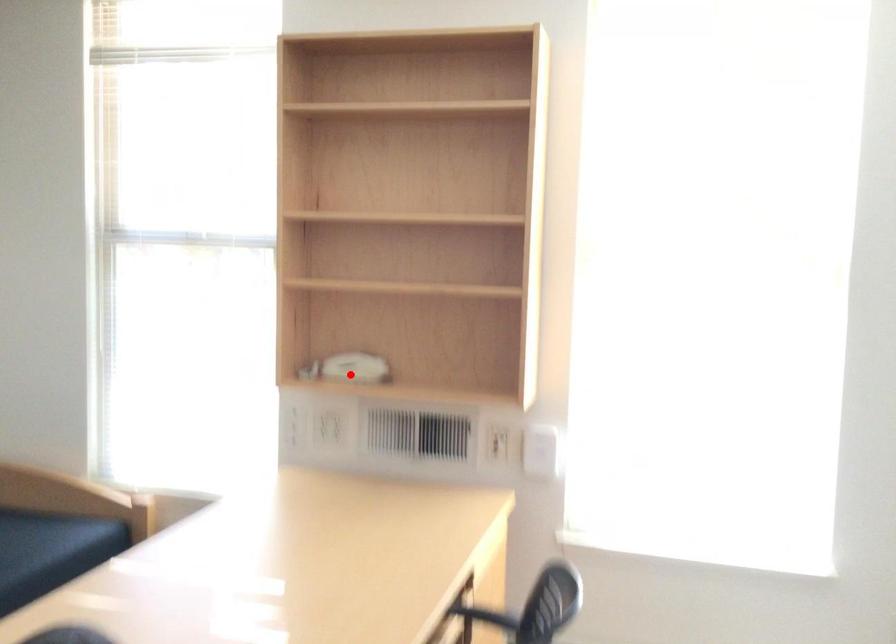
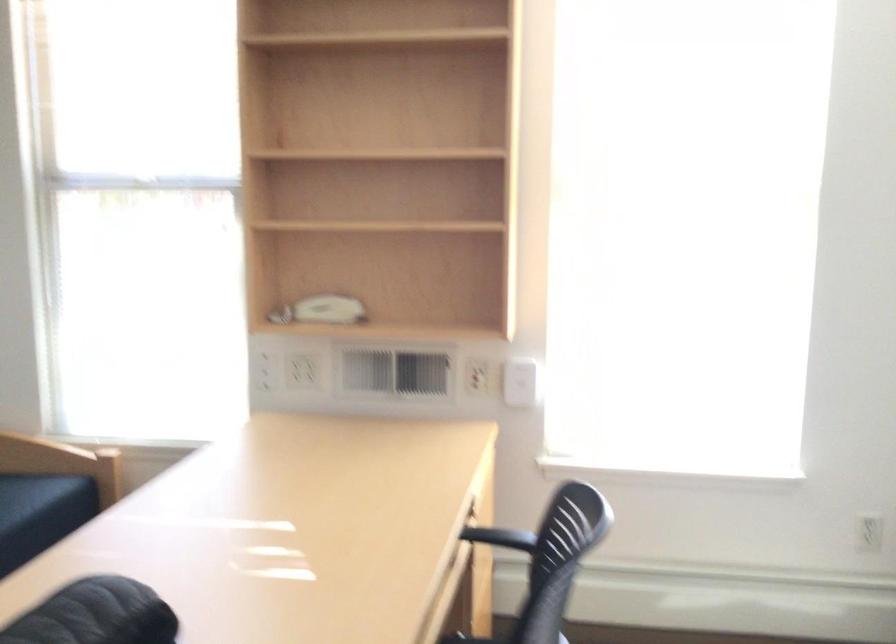
Question: I am providing you with two images of the same scene from different viewpoints. A red point is marked on the first image. Can you still see the location of the red point in image 2?

Choices:
 (A) Yes
 (B) No

Answer: (A)